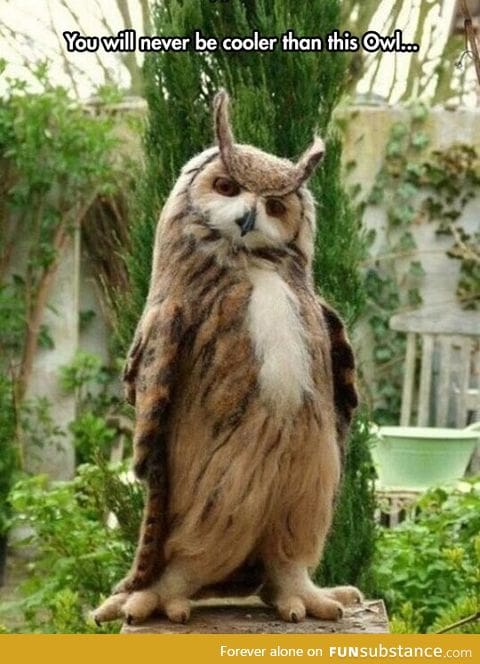
At what (x,y) coordinates should I click in order to perform the action: click on background wall. Please return your answer as a coordinate pair (x, y). The height and width of the screenshot is (664, 480). Looking at the image, I should click on (72, 56).